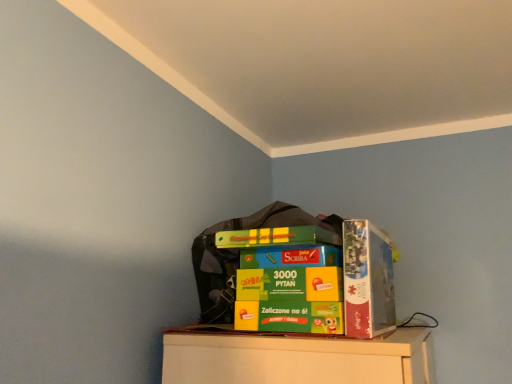
Question: Is green cardboard box at upper center far away from matte cardboard box at upper right?

Choices:
 (A) yes
 (B) no

Answer: (B)

Question: Could you tell me if green cardboard box at upper center is facing matte cardboard box at upper right?

Choices:
 (A) yes
 (B) no

Answer: (A)

Question: Is green cardboard box at upper center to the right of matte cardboard box at upper right from the viewer's perspective?

Choices:
 (A) no
 (B) yes

Answer: (A)

Question: Does green cardboard box at upper center have a lesser height compared to matte cardboard box at upper right?

Choices:
 (A) no
 (B) yes

Answer: (A)

Question: Considering the relative positions of green cardboard box at upper center and matte cardboard box at upper right in the image provided, is green cardboard box at upper center in front of matte cardboard box at upper right?

Choices:
 (A) yes
 (B) no

Answer: (A)

Question: From the image's perspective, does green cardboard box at upper center appear higher than matte cardboard box at upper right?

Choices:
 (A) yes
 (B) no

Answer: (B)

Question: From the image's perspective, is matte cardboard box at upper right beneath green cardboard box at upper center?

Choices:
 (A) yes
 (B) no

Answer: (B)

Question: Does matte cardboard box at upper right have a greater width compared to green cardboard box at upper center?

Choices:
 (A) no
 (B) yes

Answer: (A)

Question: Does matte cardboard box at upper right turn towards green cardboard box at upper center?

Choices:
 (A) no
 (B) yes

Answer: (B)

Question: Considering the relative positions of matte cardboard box at upper right and green cardboard box at upper center in the image provided, is matte cardboard box at upper right behind green cardboard box at upper center?

Choices:
 (A) no
 (B) yes

Answer: (B)

Question: Is matte cardboard box at upper right taller than green cardboard box at upper center?

Choices:
 (A) no
 (B) yes

Answer: (A)

Question: Can you confirm if matte cardboard box at upper right is positioned to the left of green cardboard box at upper center?

Choices:
 (A) yes
 (B) no

Answer: (B)

Question: Considering the positions of matte cardboard box at upper right and green cardboard box at upper center in the image, is matte cardboard box at upper right taller or shorter than green cardboard box at upper center?

Choices:
 (A) short
 (B) tall

Answer: (A)